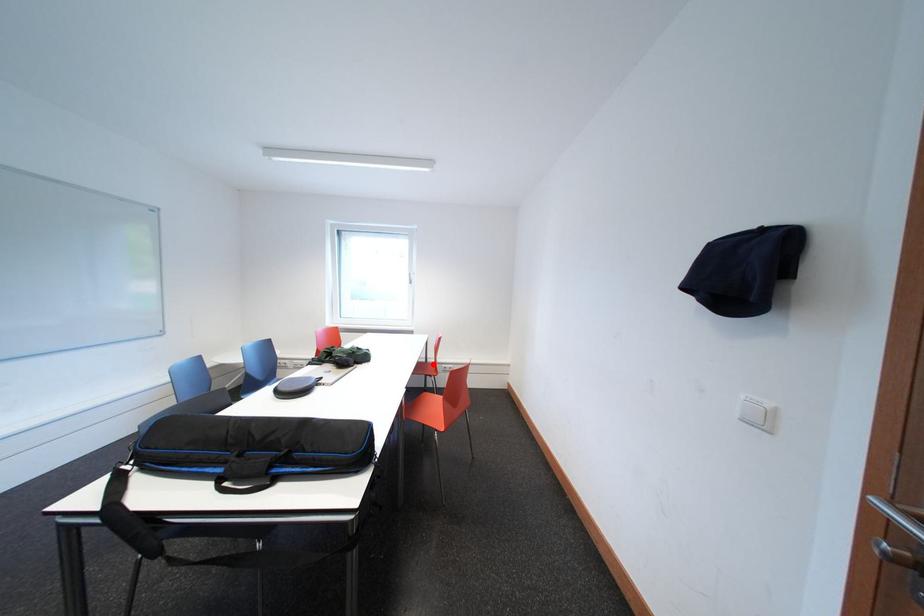
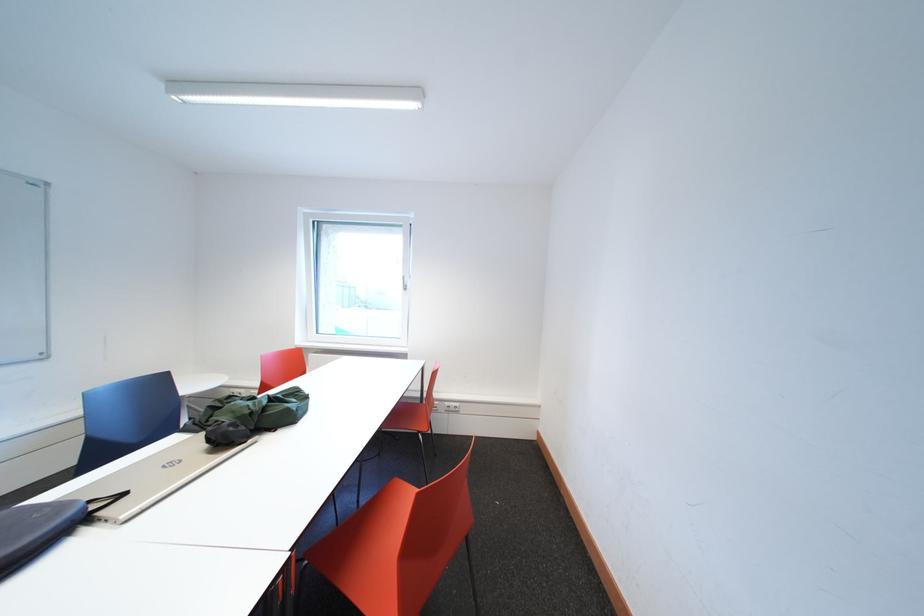
Question: I am providing you with two images of the same scene from different viewpoints. In image1, a red point is highlighted. Considering the same 3D point in image2, which of the following is correct?

Choices:
 (A) It is closer
 (B) It is farther

Answer: (A)